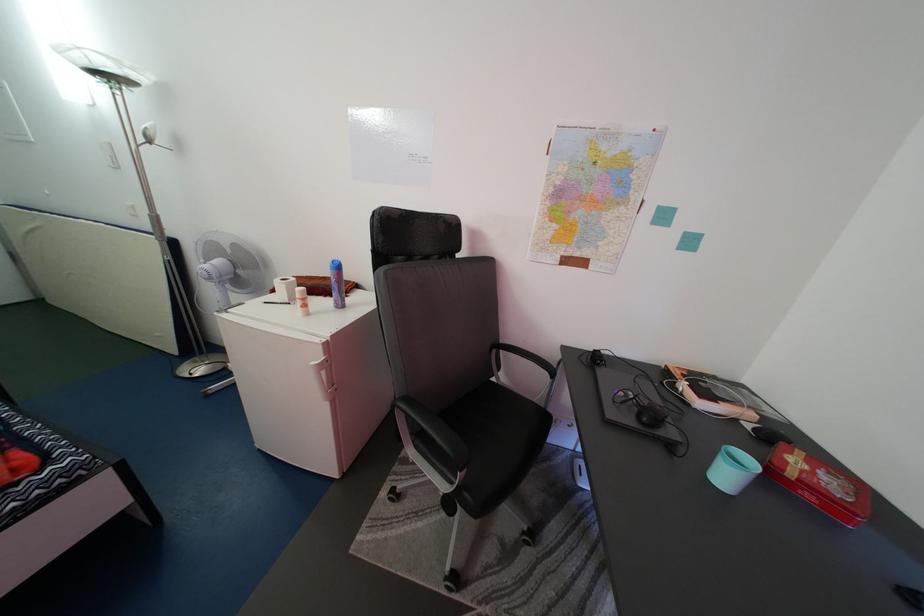
Which object does [301,301] point to?

It refers to a white glue stick.